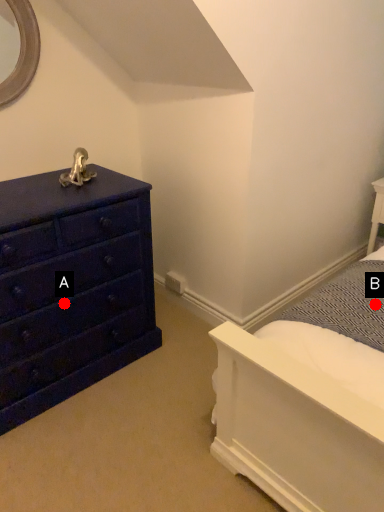
Question: Two points are circled on the image, labeled by A and B beside each circle. Which point is farther from the camera taking this photo?

Choices:
 (A) A is further
 (B) B is further

Answer: (A)